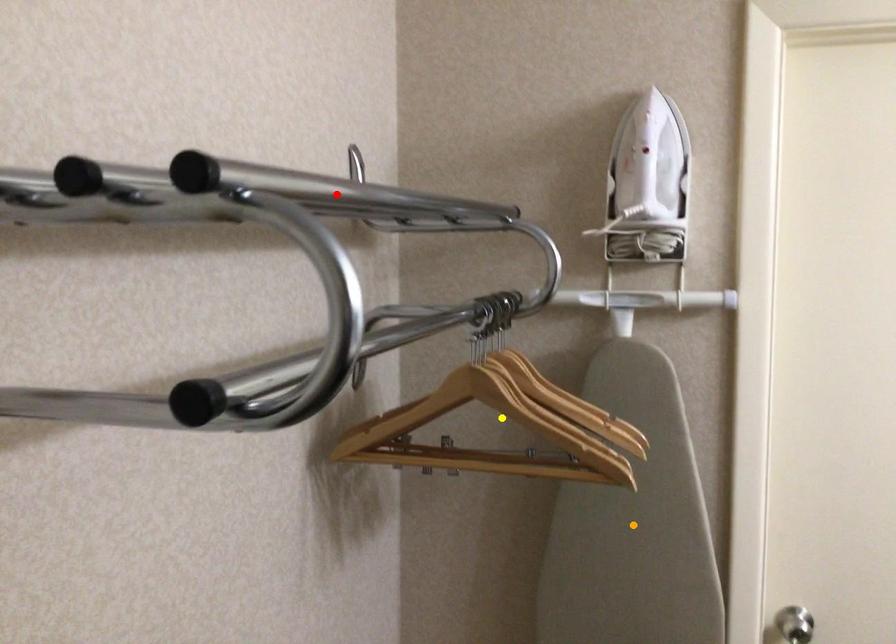
Order these from nearest to farthest:
1. yellow point
2. orange point
3. red point

yellow point, orange point, red point